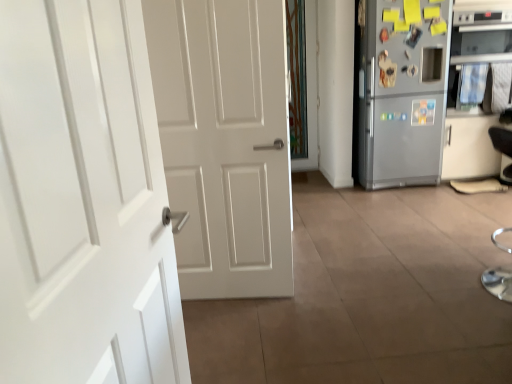
Question: Are black leather armchair at right and white glossy door at left beside each other?

Choices:
 (A) no
 (B) yes

Answer: (A)

Question: Is black leather armchair at right far from white glossy door at left?

Choices:
 (A) no
 (B) yes

Answer: (B)

Question: From the image's perspective, is black leather armchair at right under white glossy door at left?

Choices:
 (A) no
 (B) yes

Answer: (A)

Question: Does black leather armchair at right lie behind white glossy door at left?

Choices:
 (A) no
 (B) yes

Answer: (B)

Question: Considering the relative positions of black leather armchair at right and white glossy door at left in the image provided, is black leather armchair at right in front of white glossy door at left?

Choices:
 (A) yes
 (B) no

Answer: (B)

Question: Which is correct: silver metallic oven at right is inside silver metallic refrigerator at right, or outside of it?

Choices:
 (A) outside
 (B) inside

Answer: (A)

Question: Is silver metallic oven at right bigger or smaller than silver metallic refrigerator at right?

Choices:
 (A) small
 (B) big

Answer: (A)

Question: Based on their positions, is silver metallic oven at right located to the left or right of silver metallic refrigerator at right?

Choices:
 (A) left
 (B) right

Answer: (B)

Question: Is silver metallic oven at right wider or thinner than silver metallic refrigerator at right?

Choices:
 (A) wide
 (B) thin

Answer: (A)

Question: From a real-world perspective, is black leather armchair at right physically located above or below silver metallic refrigerator at right?

Choices:
 (A) above
 (B) below

Answer: (B)

Question: Looking at their shapes, would you say black leather armchair at right is wider or thinner than silver metallic refrigerator at right?

Choices:
 (A) thin
 (B) wide

Answer: (A)

Question: From the image's perspective, is black leather armchair at right positioned above or below silver metallic refrigerator at right?

Choices:
 (A) below
 (B) above

Answer: (A)

Question: Is black leather armchair at right inside the boundaries of silver metallic refrigerator at right, or outside?

Choices:
 (A) outside
 (B) inside

Answer: (A)

Question: Is black leather armchair at right situated inside silver metallic oven at right or outside?

Choices:
 (A) outside
 (B) inside

Answer: (A)

Question: From a real-world perspective, is black leather armchair at right positioned above or below silver metallic oven at right?

Choices:
 (A) above
 (B) below

Answer: (B)